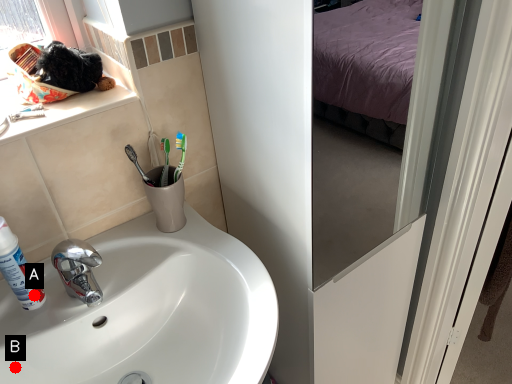
Question: Two points are circled on the image, labeled by A and B beside each circle. Which point is further to the camera?

Choices:
 (A) A is further
 (B) B is further

Answer: (A)